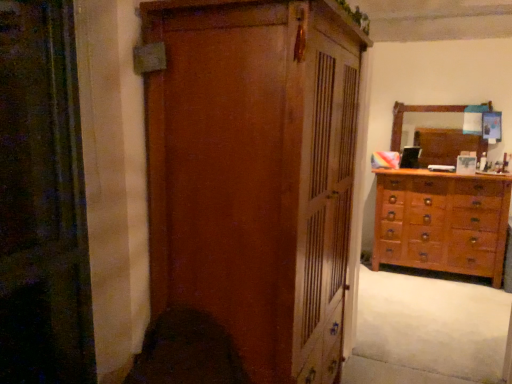
What do you see at coordinates (442, 222) in the screenshot? I see `wooden dresser at right` at bounding box center [442, 222].

This screenshot has height=384, width=512. Find the location of `white soft carpet at lower right`. white soft carpet at lower right is located at coordinates (426, 331).

This screenshot has width=512, height=384. What do you see at coordinates (248, 188) in the screenshot? I see `wooden wardrobe at center` at bounding box center [248, 188].

Locate an element on the screen. The image size is (512, 384). wooden dresser at right is located at coordinates (442, 222).

Is wooden dresser at right wider or thinner than wooden mirror at upper right?

Considering their sizes, wooden dresser at right looks broader than wooden mirror at upper right.

Are wooden dresser at right and wooden mirror at upper right beside each other?

No, wooden dresser at right is not making contact with wooden mirror at upper right.

Which point is more forward, (490, 242) or (418, 142)?

Positioned in front is point (490, 242).

Looking at this image, from the image's perspective, is wooden dresser at right beneath wooden mirror at upper right?

Yes.

In terms of width, does wooden dresser at right look wider or thinner when compared to wooden wardrobe at center?

In the image, wooden dresser at right appears to be more narrow than wooden wardrobe at center.

Considering the positions of objects wooden dresser at right and wooden wardrobe at center in the image provided, who is in front, wooden dresser at right or wooden wardrobe at center?

Positioned in front is wooden wardrobe at center.

Is wooden dresser at right far away from wooden wardrobe at center?

Yes, wooden dresser at right and wooden wardrobe at center are located far from each other.

Can you tell me how much wooden dresser at right and wooden wardrobe at center differ in facing direction?

The angle between the facing direction of wooden dresser at right and the facing direction of wooden wardrobe at center is 90 degrees.

Which of these two, wooden mirror at upper right or wooden dresser at right, is thinner?

With smaller width is wooden mirror at upper right.

Is wooden dresser at right at the back of wooden mirror at upper right?

No, wooden dresser at right is not at the back of wooden mirror at upper right.

Are wooden mirror at upper right and wooden dresser at right far apart?

Actually, wooden mirror at upper right and wooden dresser at right are a little close together.

Identify the location of mirror on the right side of wooden dresser at right. This screenshot has height=384, width=512. (x=446, y=145).

Is point (483, 327) in front of point (262, 25)?

That is False.

Can you tell me how much white soft carpet at lower right and wooden wardrobe at center differ in facing direction?

179 degrees.

Between white soft carpet at lower right and wooden wardrobe at center, which one has larger width?

white soft carpet at lower right.

Considering the relative sizes of white soft carpet at lower right and wooden wardrobe at center in the image provided, is white soft carpet at lower right taller than wooden wardrobe at center?

Incorrect, the height of white soft carpet at lower right is not larger of that of wooden wardrobe at center.

From a real-world perspective, is wooden wardrobe at center on top of white soft carpet at lower right?

Yes.

Is wooden wardrobe at center directly adjacent to white soft carpet at lower right?

wooden wardrobe at center and white soft carpet at lower right are not in contact.

Which is more to the left, wooden wardrobe at center or white soft carpet at lower right?

wooden wardrobe at center is more to the left.

Does wooden wardrobe at center have a smaller size compared to white soft carpet at lower right?

Actually, wooden wardrobe at center might be larger than white soft carpet at lower right.

From the picture: Is wooden mirror at upper right positioned with its back to wooden wardrobe at center?

That's not correct — wooden mirror at upper right is not looking away from wooden wardrobe at center.

Does point (449, 145) lie in front of point (257, 323)?

No.

Considering the sizes of objects wooden mirror at upper right and wooden wardrobe at center in the image provided, who is smaller, wooden mirror at upper right or wooden wardrobe at center?

With smaller size is wooden mirror at upper right.

How much distance is there between wooden mirror at upper right and wooden wardrobe at center?

3.22 meters.

At what (x,y) coordinates should I click in order to perform the action: click on plain that is below the wooden mirror at upper right (from the image's perspective). Please return your answer as a coordinate pair (x, y). Image resolution: width=512 pixels, height=384 pixels. Looking at the image, I should click on (426, 331).

Is wooden mirror at upper right behind white soft carpet at lower right?

Yes, it is.

Does wooden mirror at upper right appear on the left side of white soft carpet at lower right?

In fact, wooden mirror at upper right is to the right of white soft carpet at lower right.

Considering the points (486, 149) and (464, 354), which point is behind, point (486, 149) or point (464, 354)?

Point (486, 149)

Find the location of a particular element. The height and width of the screenshot is (384, 512). mirror above the wooden dresser at right (from a real-world perspective) is located at coordinates [446, 145].

Locate an element on the screen. cupboard above the wooden dresser at right (from the image's perspective) is located at coordinates (248, 188).

Looking at the image, which one is located closer to wooden wardrobe at center, wooden mirror at upper right or wooden dresser at right?

Among the two, wooden dresser at right is located nearer to wooden wardrobe at center.

Based on their spatial positions, is wooden wardrobe at center or wooden mirror at upper right closer to white soft carpet at lower right?

Among the two, wooden mirror at upper right is located nearer to white soft carpet at lower right.

Based on their spatial positions, is white soft carpet at lower right or wooden mirror at upper right further from wooden dresser at right?

white soft carpet at lower right is positioned further to the anchor wooden dresser at right.

Considering their positions, is white soft carpet at lower right positioned further to wooden wardrobe at center than wooden dresser at right?

wooden dresser at right lies further to wooden wardrobe at center than the other object.

When comparing their distances from wooden mirror at upper right, does white soft carpet at lower right or wooden dresser at right seem closer?

wooden dresser at right.

From the picture: Based on their spatial positions, is wooden mirror at upper right or wooden wardrobe at center closer to wooden dresser at right?

Based on the image, wooden mirror at upper right appears to be nearer to wooden dresser at right.

From the image, which object appears to be farther from wooden mirror at upper right, wooden dresser at right or white soft carpet at lower right?

white soft carpet at lower right is positioned further to the anchor wooden mirror at upper right.

From the image, which object appears to be farther from wooden dresser at right, wooden wardrobe at center or wooden mirror at upper right?

wooden wardrobe at center is positioned further to the anchor wooden dresser at right.

This screenshot has width=512, height=384. I want to click on plain located between wooden wardrobe at center and wooden dresser at right in the depth direction, so click(426, 331).

Identify the location of the chest of drawers located between white soft carpet at lower right and wooden mirror at upper right in the depth direction. (442, 222).

Locate an element on the screen. The width and height of the screenshot is (512, 384). plain between wooden wardrobe at center and wooden mirror at upper right from front to back is located at coordinates (426, 331).

I want to click on the chest of drawers positioned between wooden wardrobe at center and wooden mirror at upper right from near to far, so click(x=442, y=222).